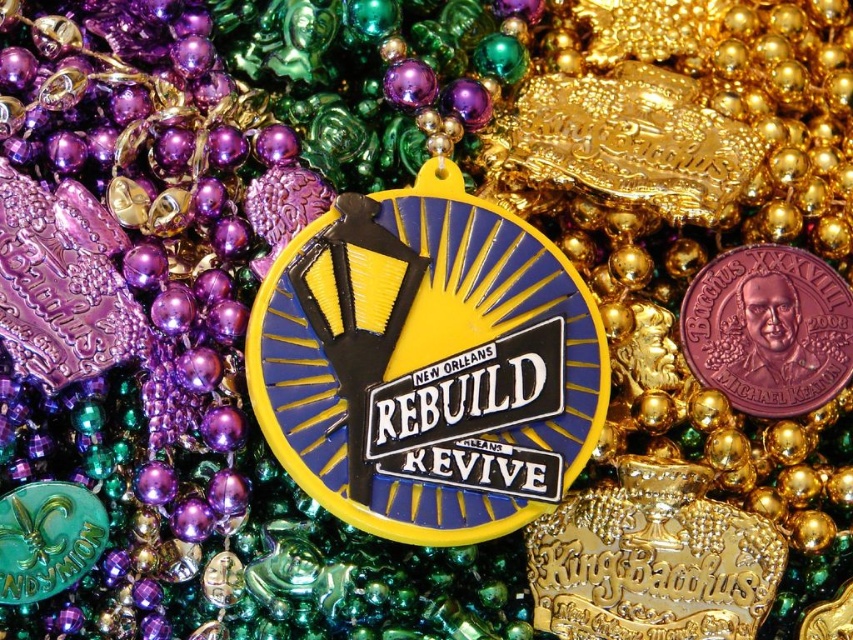
You are organizing a Mardi Gras display and want to ensure the yellow plastic badge at center and the pink clay coin at center are visible. Based on their positions, which one is more likely to be seen first by someone looking at the display?

The yellow plastic badge at center is more likely to be seen first because it is in front of the pink clay coin at center, making it closer to the viewer.

You are organizing a Mardi Gras display and need to arrange the yellow plastic badge at center and the pink clay coin at center on a shelf. Which object will require a taller space to display properly?

The yellow plastic badge at center is much taller than the pink clay coin at center, so it will require a taller space to display properly.